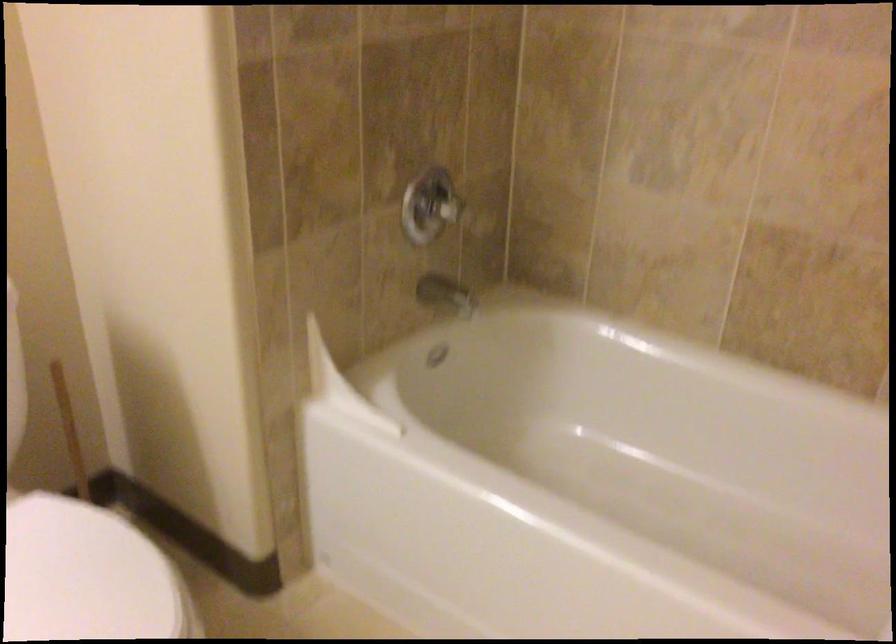
The image size is (896, 644). I want to click on white toilet lid, so click(x=88, y=576).